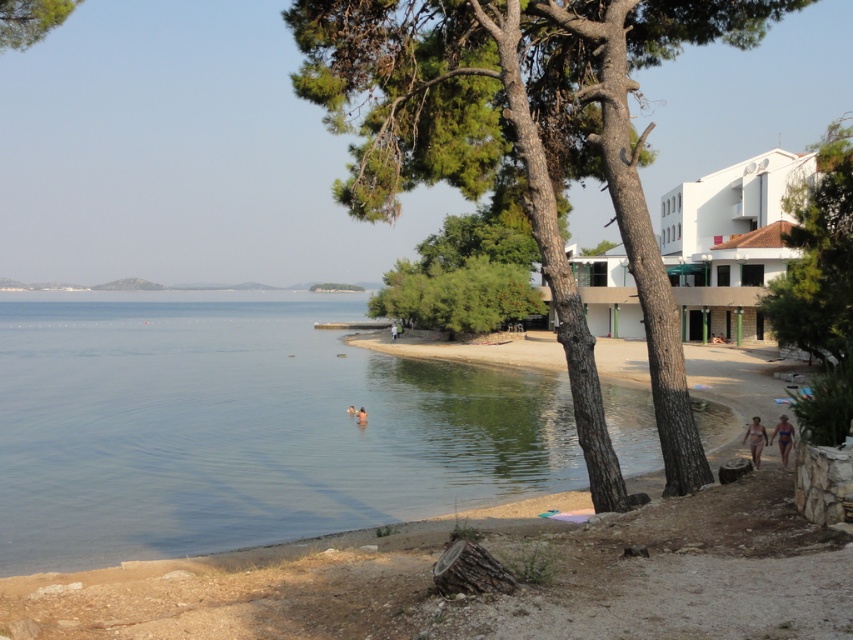
Which is more to the left, green leafy tree at right or skinny bikini swimmer at center?

skinny bikini swimmer at center

Locate an element on the screen. The width and height of the screenshot is (853, 640). green leafy tree at right is located at coordinates (820, 288).

Is green leafy tree at right below blue fabric bikini at lower right?

No.

Is green leafy tree at right positioned before blue fabric bikini at lower right?

Yes, green leafy tree at right is closer to the viewer.

Between point (798, 220) and point (782, 432), which one is positioned in front?

Point (782, 432) is more forward.

Where is `green leafy tree at right`? green leafy tree at right is located at coordinates (820, 288).

Does clear water at beach left have a greater width compared to skinny bikini swimmer at center?

Yes, clear water at beach left is wider than skinny bikini swimmer at center.

Where is `clear water at beach left`? The height and width of the screenshot is (640, 853). clear water at beach left is located at coordinates (242, 428).

Describe the element at coordinates (242, 428) in the screenshot. I see `clear water at beach left` at that location.

Find the location of a particular element. Image resolution: width=853 pixels, height=640 pixels. clear water at beach left is located at coordinates (242, 428).